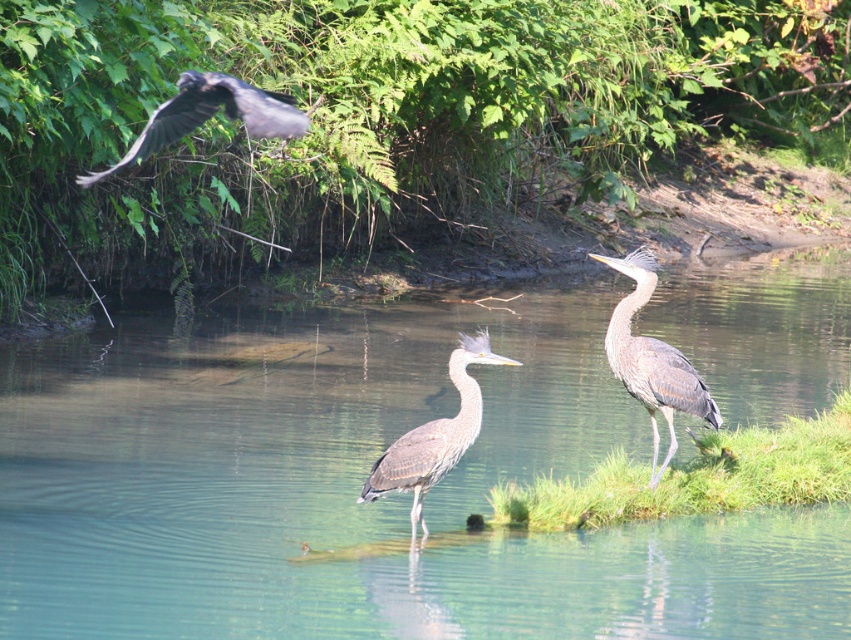
Looking at this image, you are a birdwatcher observing the scene. You notice the clear water at center and the gray feathered crow at upper left. Which object is located to the right of the other?

The clear water at center is positioned on the right side of gray feathered crow at upper left, so the clear water at center is to the right of the gray feathered crow at upper left.